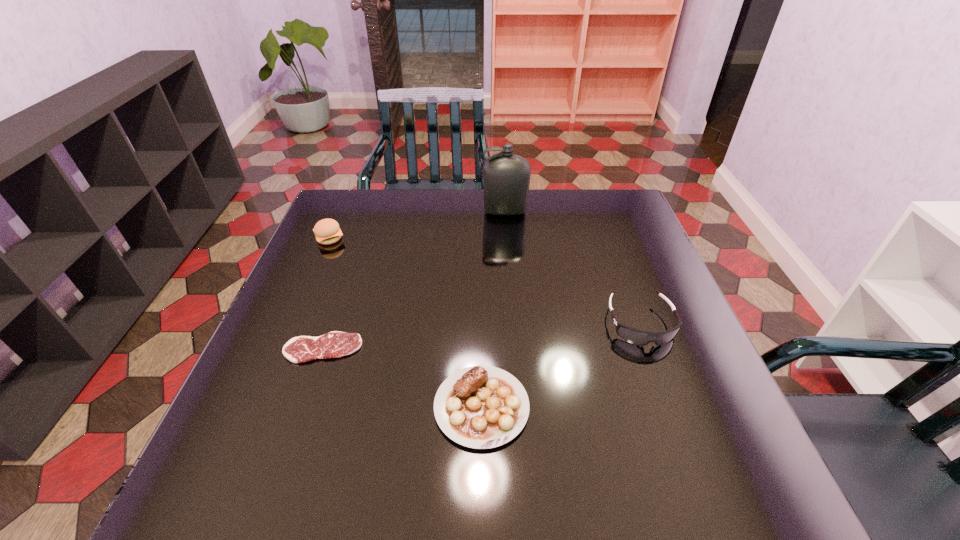
Where is `free space at the far edge of the desktop`? free space at the far edge of the desktop is located at coordinates (468, 202).

The image size is (960, 540). In order to click on vacant space at the near edge in this screenshot , I will do `click(424, 462)`.

Image resolution: width=960 pixels, height=540 pixels. Identify the location of vacant space at the left edge. (249, 380).

Locate an element on the screen. Image resolution: width=960 pixels, height=540 pixels. vacant space at the right edge of the desktop is located at coordinates (708, 433).

The width and height of the screenshot is (960, 540). Identify the location of free space between the right steak and the hamburger. (405, 323).

The width and height of the screenshot is (960, 540). What are the coordinates of `free spot between the tallest object and the hamburger` in the screenshot? It's located at 418,225.

At what (x,y) coordinates should I click in order to perform the action: click on vacant space in between the farther steak and the right steak. Please return your answer as a coordinate pair (x, y). The height and width of the screenshot is (540, 960). Looking at the image, I should click on (402, 377).

The image size is (960, 540). Find the location of `vacant area that lies between the nearer steak and the farther steak`. vacant area that lies between the nearer steak and the farther steak is located at coordinates (402, 377).

Locate an element on the screen. This screenshot has height=540, width=960. free space between the farthest object and the hamburger is located at coordinates (418, 225).

Locate an element on the screen. This screenshot has height=540, width=960. vacant space that is in between the farthest object and the fourth nearest object is located at coordinates (418, 225).